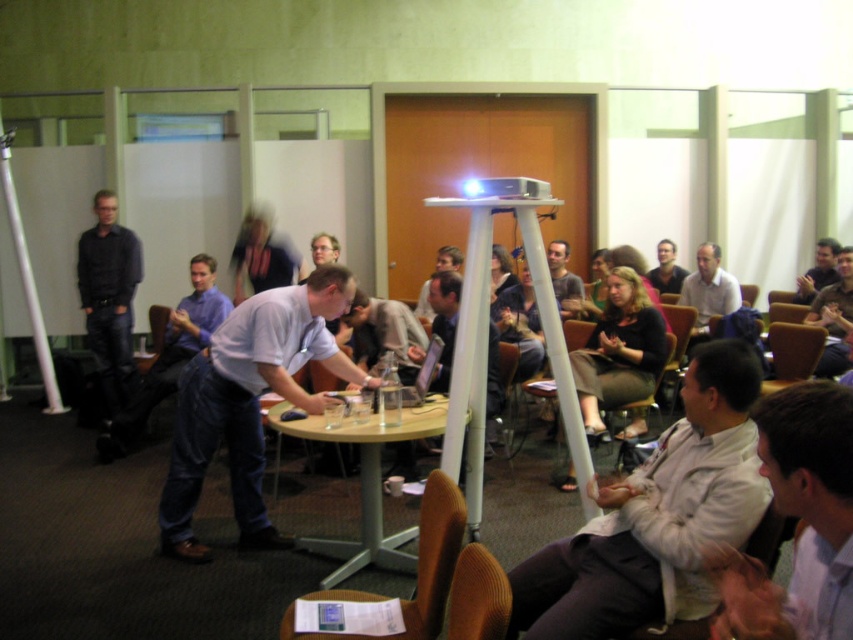
Is light blue shirt at center to the left of light blue shirt at lower right from the viewer's perspective?

Correct, you'll find light blue shirt at center to the left of light blue shirt at lower right.

Does point (180, 456) come closer to viewer compared to point (833, 465)?

No, (180, 456) is further to viewer.

Where is `light blue shirt at center`? light blue shirt at center is located at coordinates (250, 401).

Is point (184, 524) closer to viewer compared to point (828, 237)?

Yes, it is.

Is point (169, 465) farther from viewer compared to point (802, 284)?

That is False.

Which is behind, point (233, 509) or point (808, 284)?

The point (808, 284) is more distant.

The height and width of the screenshot is (640, 853). I want to click on light blue shirt at center, so click(250, 401).

Can you confirm if wooden chair at lower right is positioned to the right of dark gray shirt at center?

Correct, you'll find wooden chair at lower right to the right of dark gray shirt at center.

Can you confirm if wooden chair at lower right is positioned to the left of dark gray shirt at center?

In fact, wooden chair at lower right is to the right of dark gray shirt at center.

This screenshot has height=640, width=853. What do you see at coordinates (792, 353) in the screenshot? I see `wooden chair at lower right` at bounding box center [792, 353].

The image size is (853, 640). I want to click on wooden chair at lower right, so click(792, 353).